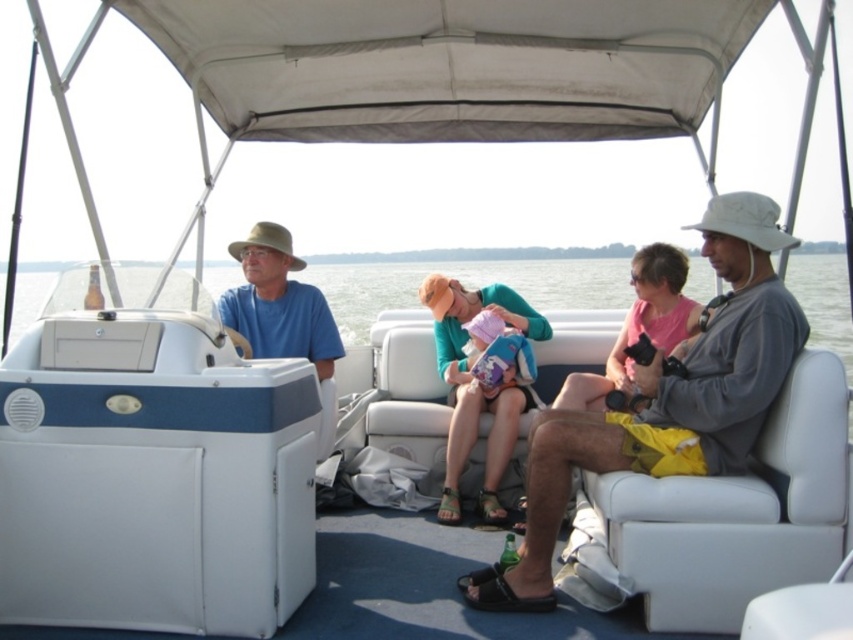
Question: Among these objects, which one is farthest from the camera?

Choices:
 (A) pink fabric bag at center
 (B) matte green sweater at center
 (C) clear water at center
 (D) gray fabric hat at center

Answer: (B)

Question: Is clear water at center positioned behind matte green sweater at center?

Choices:
 (A) yes
 (B) no

Answer: (B)

Question: Which point is closer to the camera?

Choices:
 (A) pink fabric bag at center
 (B) gray fabric hat at center
 (C) matte green sweater at center

Answer: (B)

Question: Among these points, which one is farthest from the camera?

Choices:
 (A) (670, 296)
 (B) (843, 317)

Answer: (B)

Question: Considering the relative positions of clear water at center and pink fabric bag at center in the image provided, where is clear water at center located with respect to pink fabric bag at center?

Choices:
 (A) right
 (B) left

Answer: (B)

Question: Does gray fabric hat at center have a lesser width compared to pink fabric bag at center?

Choices:
 (A) yes
 (B) no

Answer: (B)